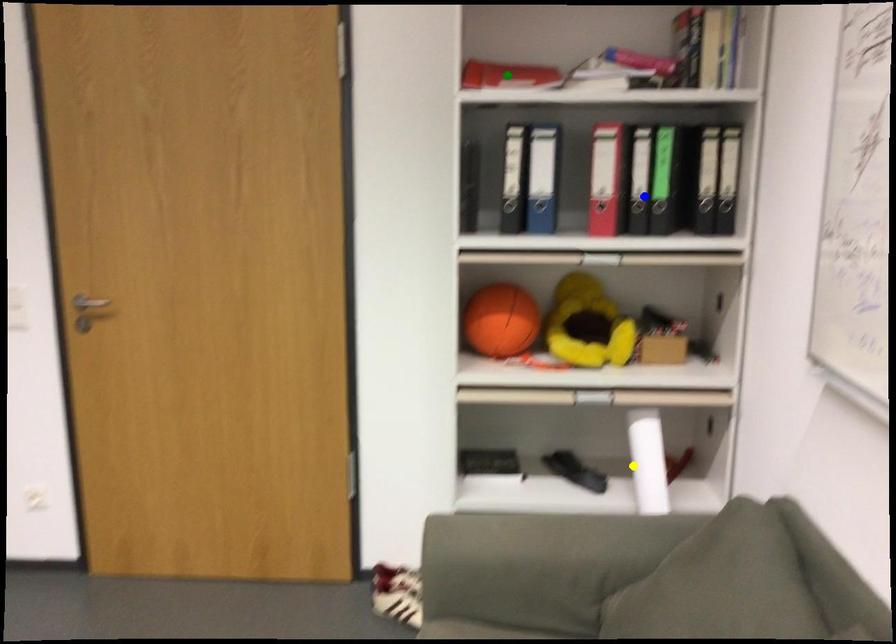
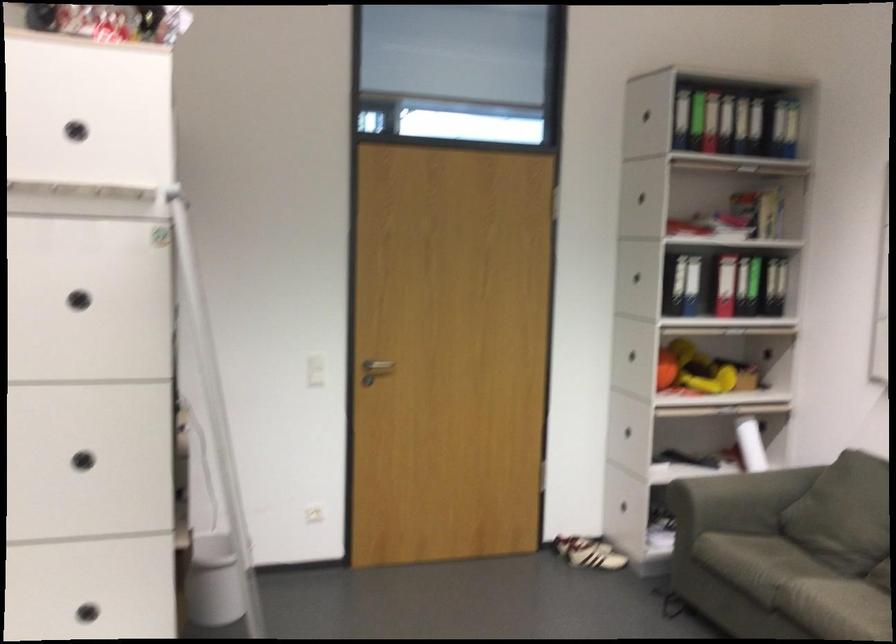
I am providing you with two images of the same scene from different viewpoints. Three points are marked in image1. Which point corresponds to a part or object that is occluded in image2?In image1, three points are marked. Which of them correspond to a part or object that is occluded in image2?Among the three points shown in image1, which one corresponds to a part or object that is no longer visible due to occlusion in image2?

green point